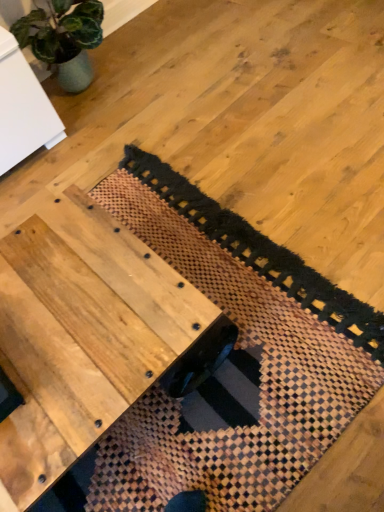
At what (x,y) coordinates should I click in order to perform the action: click on vacant space underneath wooden woven mat at center (from a real-world perspective). Please return your answer as a coordinate pair (x, y). Looking at the image, I should click on (216, 298).